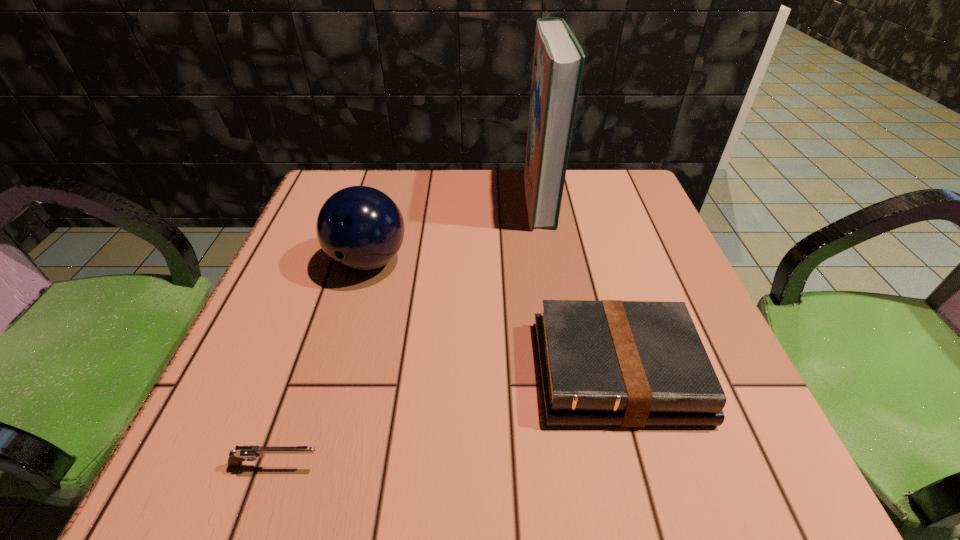
The image size is (960, 540). I want to click on the farther hardback book, so click(558, 62).

The width and height of the screenshot is (960, 540). I want to click on the tallest object, so click(x=558, y=62).

Find the location of `bowling ball`. bowling ball is located at coordinates (360, 228).

This screenshot has height=540, width=960. What are the coordinates of `the second farthest object` in the screenshot? It's located at (360, 228).

The height and width of the screenshot is (540, 960). Identify the location of the shorter hardback book. (620, 363).

Where is `the nearer hardback book`? Image resolution: width=960 pixels, height=540 pixels. the nearer hardback book is located at coordinates (620, 363).

Find the location of a particular element. the shortest object is located at coordinates (246, 452).

Where is `pistol`? The width and height of the screenshot is (960, 540). pistol is located at coordinates (246, 452).

Image resolution: width=960 pixels, height=540 pixels. Identify the location of free point located 0.230m on the cover of the farthest object. (427, 198).

Find the location of a particular element. vacant space located 0.070m on the cover of the farthest object is located at coordinates (495, 198).